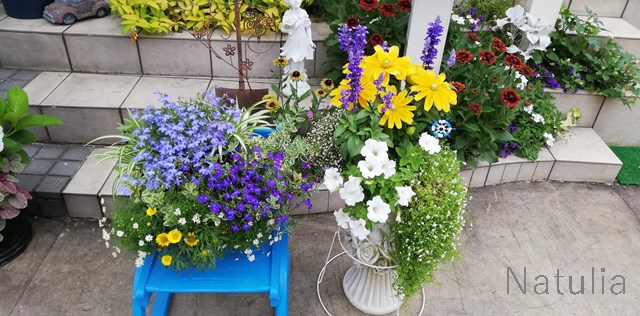
This screenshot has width=640, height=316. Identify the location of white vase. (376, 287).